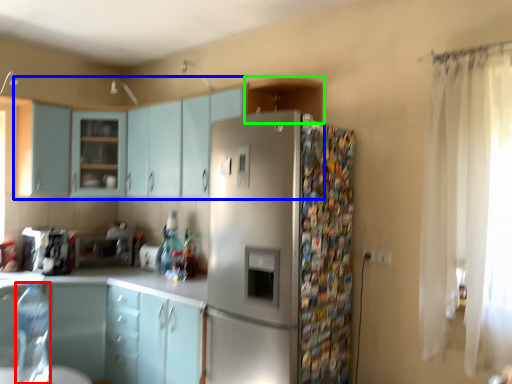
Question: Which object is positioned farthest from bottle (highlighted by a red box)? Select from cabinetry (highlighted by a blue box) and cabinetry (highlighted by a green box).

Choices:
 (A) cabinetry
 (B) cabinetry

Answer: (B)